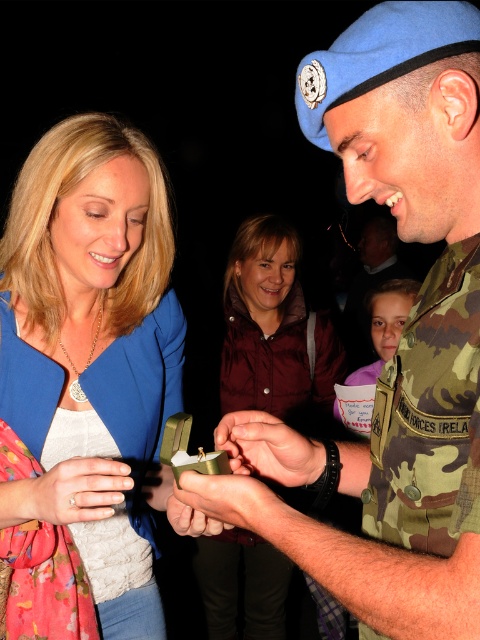
Question: Which object appears farthest from the camera in this image?

Choices:
 (A) blue fabric jacket at upper left
 (B) camouflage uniform at center
 (C) smooth skin hand at center

Answer: (C)

Question: Is camouflage fabric hand at center smaller than metallic gold ring at center?

Choices:
 (A) yes
 (B) no

Answer: (A)

Question: Is camouflage uniform at center further to the viewer compared to gold metallic ring at lower left?

Choices:
 (A) yes
 (B) no

Answer: (B)

Question: Is camouflage uniform at center closer to the viewer compared to metallic gold ring at center?

Choices:
 (A) yes
 (B) no

Answer: (A)

Question: Which of the following is the farthest from the observer?

Choices:
 (A) camouflage fabric hand at center
 (B) camo fabric uniform at center
 (C) camouflage uniform at center

Answer: (B)

Question: Which object is the closest to the gold metallic ring at lower left?

Choices:
 (A) camouflage fabric hand at center
 (B) camouflage uniform at center
 (C) camo fabric uniform at center
 (D) smooth skin hand at center

Answer: (D)